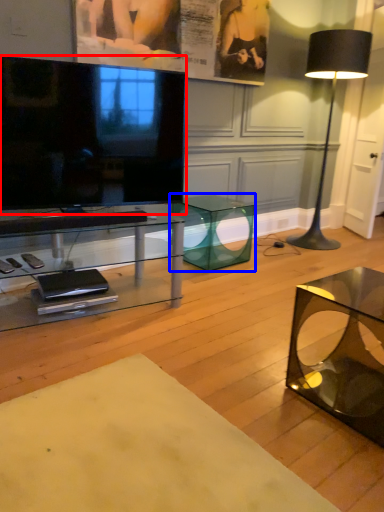
Question: Which object appears closest to the camera in this image, television (highlighted by a red box) or table (highlighted by a blue box)?

Choices:
 (A) television
 (B) table

Answer: (A)